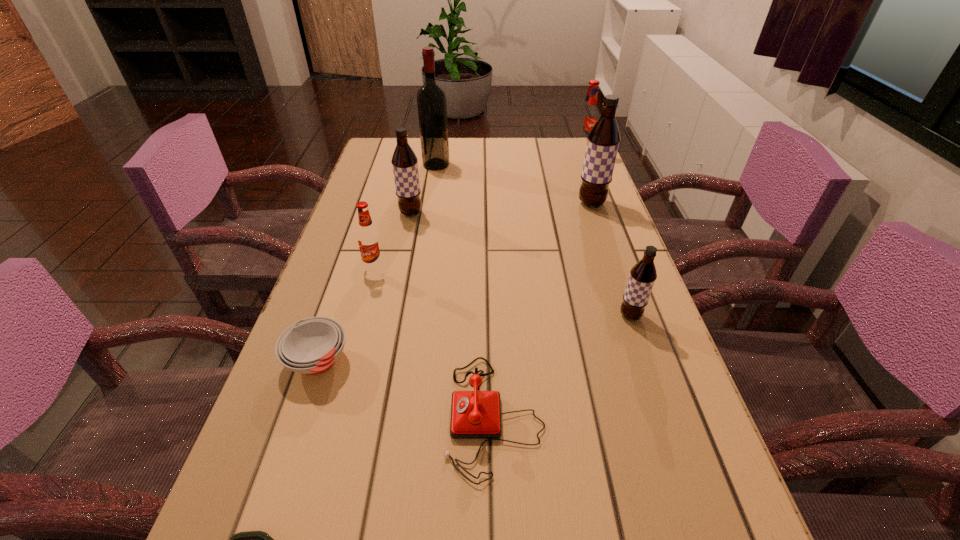
Locate an element on the screen. Image resolution: width=960 pixels, height=540 pixels. vacant space located 0.120m on the dial of the red telephone is located at coordinates (375, 416).

The height and width of the screenshot is (540, 960). I want to click on free spot located on the dial of the red telephone, so click(x=411, y=416).

Find the location of a particular element. The image size is (960, 540). free space located 0.340m on the back of the soup bowl is located at coordinates (360, 234).

At what (x,y) coordinates should I click in order to perform the action: click on alcohol positioned at the far edge. Please return your answer as a coordinate pair (x, y). Looking at the image, I should click on (431, 99).

Locate an element on the screen. Image resolution: width=960 pixels, height=540 pixels. root beer that is at the far edge is located at coordinates (588, 116).

Where is `soup bowl at the left edge`? The image size is (960, 540). soup bowl at the left edge is located at coordinates (311, 346).

Locate an element on the screen. object at the far right corner is located at coordinates (588, 116).

Locate an element on the screen. This screenshot has width=960, height=540. free space at the far edge of the desktop is located at coordinates (521, 167).

Locate an element on the screen. The image size is (960, 540). vacant region at the left edge is located at coordinates (354, 239).

At what (x,y) coordinates should I click in order to perform the action: click on vacant space at the right edge of the desktop. Please return your answer as a coordinate pair (x, y). This screenshot has width=960, height=540. Looking at the image, I should click on (576, 187).